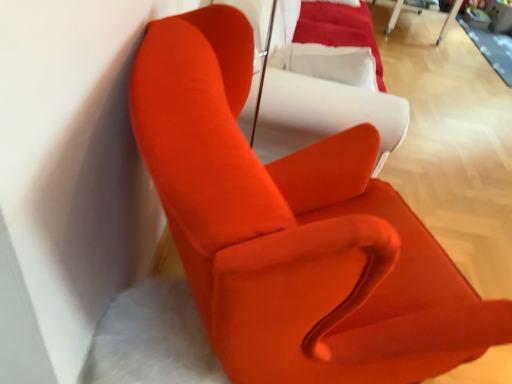
Question: Does point (455, 3) appear closer or farther from the camera than point (247, 16)?

Choices:
 (A) closer
 (B) farther

Answer: (B)

Question: From the image's perspective, relative to satin white couch at center, is white plastic table at upper right above or below?

Choices:
 (A) above
 (B) below

Answer: (A)

Question: Which object is positioned farthest from the matte orange armchair at upper left?

Choices:
 (A) white plastic table at upper right
 (B) satin white couch at center

Answer: (A)

Question: Based on their relative distances, which object is farther from the matte orange armchair at upper left?

Choices:
 (A) white plastic table at upper right
 (B) satin white couch at center

Answer: (A)